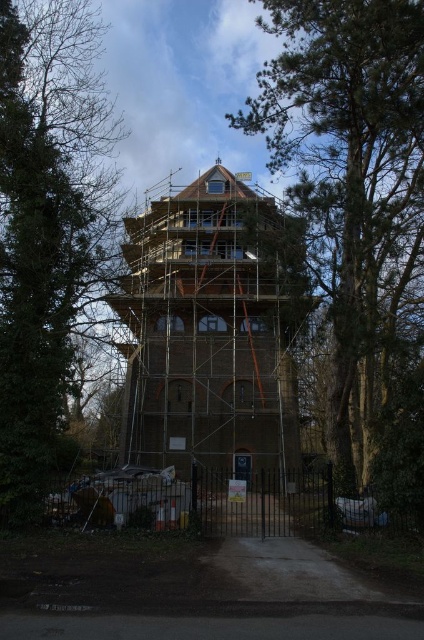
Does green textured tree at upper center have a lesser width compared to brown brick tower at center?

Yes.

Is green textured tree at upper center taller than brown brick tower at center?

Yes.

Which is in front, point (359, 102) or point (262, 355)?

Point (359, 102)

Where is `green textured tree at upper center`? This screenshot has height=640, width=424. green textured tree at upper center is located at coordinates (351, 184).

Is green leafy tree at left positioned behind brown brick tower at center?

No, green leafy tree at left is closer to the viewer.

Who is more distant from viewer, (x=35, y=241) or (x=273, y=396)?

The point (x=273, y=396) is behind.

The image size is (424, 640). I want to click on green leafy tree at left, so click(50, 234).

Which is behind, point (284, 125) or point (106, 266)?

The point (284, 125) is behind.

Image resolution: width=424 pixels, height=640 pixels. Find the location of `green textured tree at upper center`. green textured tree at upper center is located at coordinates (351, 184).